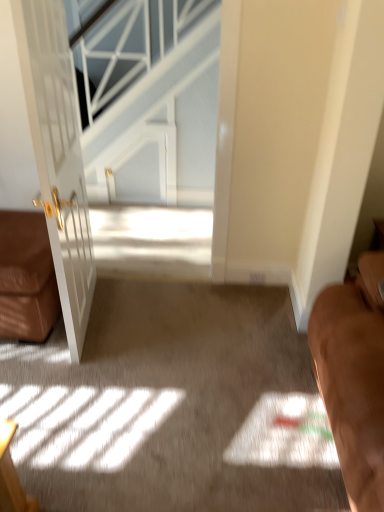
Question: Considering the positions of point (178, 6) and point (59, 91), is point (178, 6) closer or farther from the camera than point (59, 91)?

Choices:
 (A) farther
 (B) closer

Answer: (A)

Question: From the image's perspective, relative to white glossy door at left, is white textured glass at upper center above or below?

Choices:
 (A) below
 (B) above

Answer: (B)

Question: Based on their relative distances, which object is nearer to the brown leather couch at left?

Choices:
 (A) white glossy door at left
 (B) white textured glass at upper center

Answer: (A)

Question: Estimate the real-world distances between objects in this image. Which object is closer to the white textured glass at upper center?

Choices:
 (A) white glossy door at left
 (B) brown leather couch at left

Answer: (A)